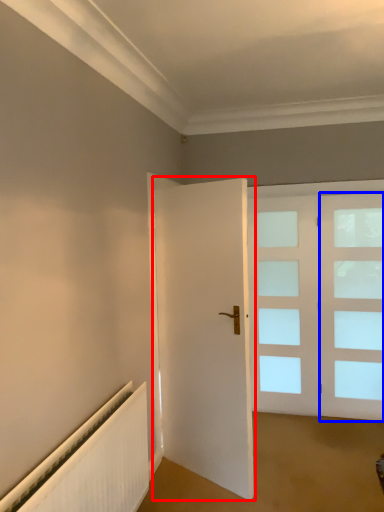
Question: Which of the following is the farthest to the observer, door (highlighted by a red box) or window (highlighted by a blue box)?

Choices:
 (A) door
 (B) window

Answer: (B)